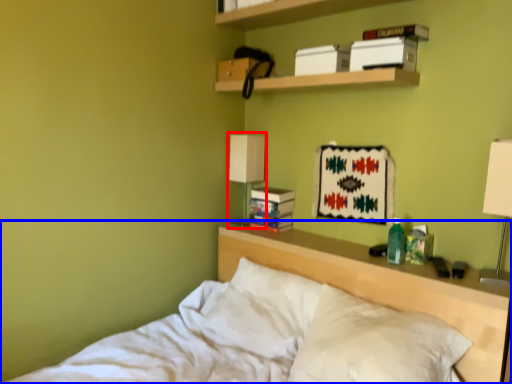
Question: Which object appears farthest to the camera in this image, lamp (highlighted by a red box) or bed (highlighted by a blue box)?

Choices:
 (A) lamp
 (B) bed

Answer: (A)